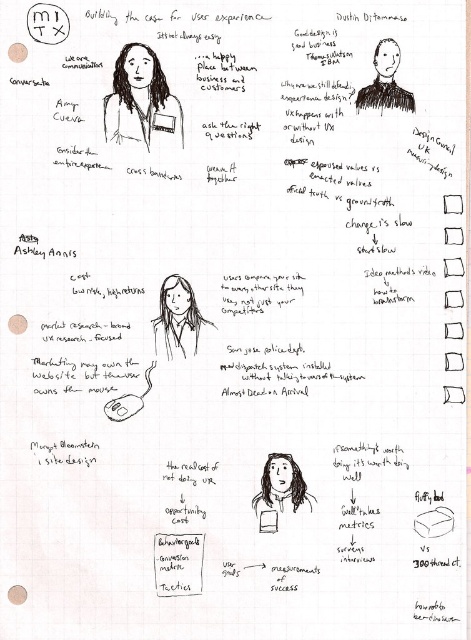
Question: Can you confirm if matte black jacket at upper left is bigger than matte black woman at upper center?

Choices:
 (A) no
 (B) yes

Answer: (B)

Question: Which object is positioned closest to the matte black hair at center?

Choices:
 (A) white paper at center
 (B) matte black jacket at upper left
 (C) matte black woman at upper center
 (D) matte white notepad at upper center

Answer: (A)

Question: Can you confirm if matte black woman at upper center is positioned to the right of matte white notepad at upper center?

Choices:
 (A) no
 (B) yes

Answer: (B)

Question: Can you confirm if matte black shirt at center is smaller than matte white notepad at upper center?

Choices:
 (A) yes
 (B) no

Answer: (B)

Question: Among these objects, which one is farthest from the camera?

Choices:
 (A) matte black woman at upper center
 (B) matte black hair at center

Answer: (B)

Question: Which object appears farthest from the camera in this image?

Choices:
 (A) matte black woman at upper center
 (B) white paper at center

Answer: (B)